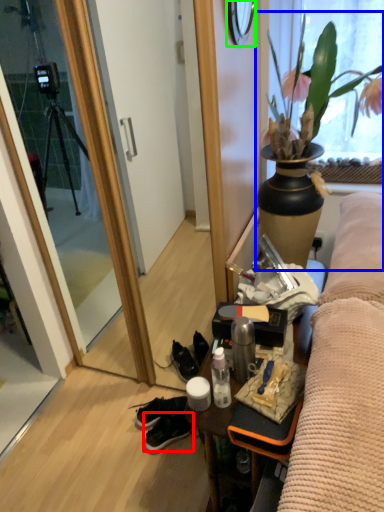
Question: Based on their relative distances, which object is farther from sneakers (highlighted by a red box)? Choose from houseplant (highlighted by a blue box) and mirror (highlighted by a green box).

Choices:
 (A) houseplant
 (B) mirror

Answer: (B)